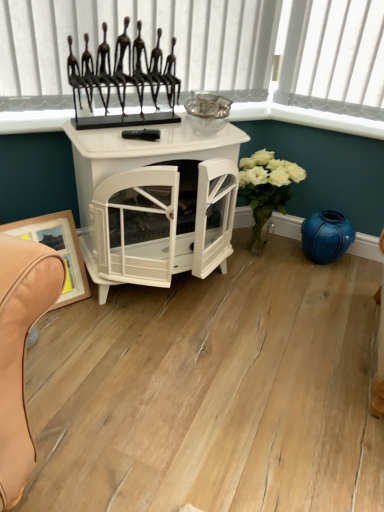
Question: Should I look upward or downward to see blue glossy vase at lower right?

Choices:
 (A) up
 (B) down

Answer: (A)

Question: From a real-world perspective, is white glossy fireplace at center over metallic black sculpture at upper center?

Choices:
 (A) no
 (B) yes

Answer: (A)

Question: Is white glossy fireplace at center shorter than metallic black sculpture at upper center?

Choices:
 (A) yes
 (B) no

Answer: (B)

Question: Is white glossy fireplace at center closer to the viewer compared to metallic black sculpture at upper center?

Choices:
 (A) yes
 (B) no

Answer: (A)

Question: Is white glossy fireplace at center not near metallic black sculpture at upper center?

Choices:
 (A) no
 (B) yes

Answer: (A)

Question: From the image's perspective, is white glossy fireplace at center above metallic black sculpture at upper center?

Choices:
 (A) no
 (B) yes

Answer: (A)

Question: Can you confirm if white glossy fireplace at center is positioned to the right of metallic black sculpture at upper center?

Choices:
 (A) no
 (B) yes

Answer: (B)

Question: Considering the relative positions of wooden framed picture at lower left and blue glossy vase at lower right in the image provided, is wooden framed picture at lower left to the right of blue glossy vase at lower right from the viewer's perspective?

Choices:
 (A) yes
 (B) no

Answer: (B)

Question: Is wooden framed picture at lower left directly adjacent to blue glossy vase at lower right?

Choices:
 (A) no
 (B) yes

Answer: (A)

Question: Considering the relative sizes of wooden framed picture at lower left and blue glossy vase at lower right in the image provided, is wooden framed picture at lower left bigger than blue glossy vase at lower right?

Choices:
 (A) yes
 (B) no

Answer: (A)

Question: Can you confirm if wooden framed picture at lower left is shorter than blue glossy vase at lower right?

Choices:
 (A) yes
 (B) no

Answer: (B)

Question: From the image's perspective, is wooden framed picture at lower left above blue glossy vase at lower right?

Choices:
 (A) yes
 (B) no

Answer: (B)

Question: Is wooden framed picture at lower left not close to blue glossy vase at lower right?

Choices:
 (A) yes
 (B) no

Answer: (A)

Question: Considering the relative positions of white glossy fireplace at center and blue glossy vase at lower right in the image provided, is white glossy fireplace at center to the left of blue glossy vase at lower right from the viewer's perspective?

Choices:
 (A) yes
 (B) no

Answer: (A)